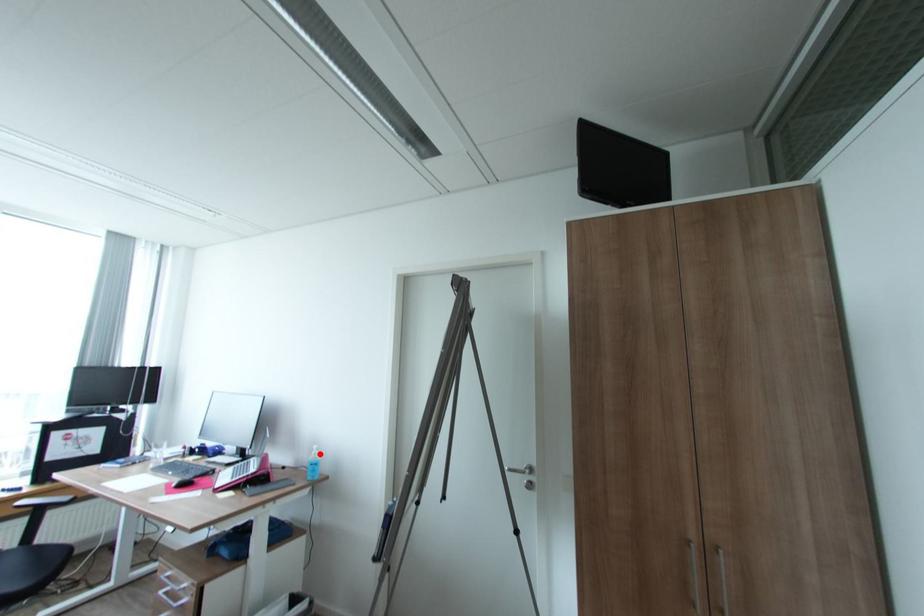
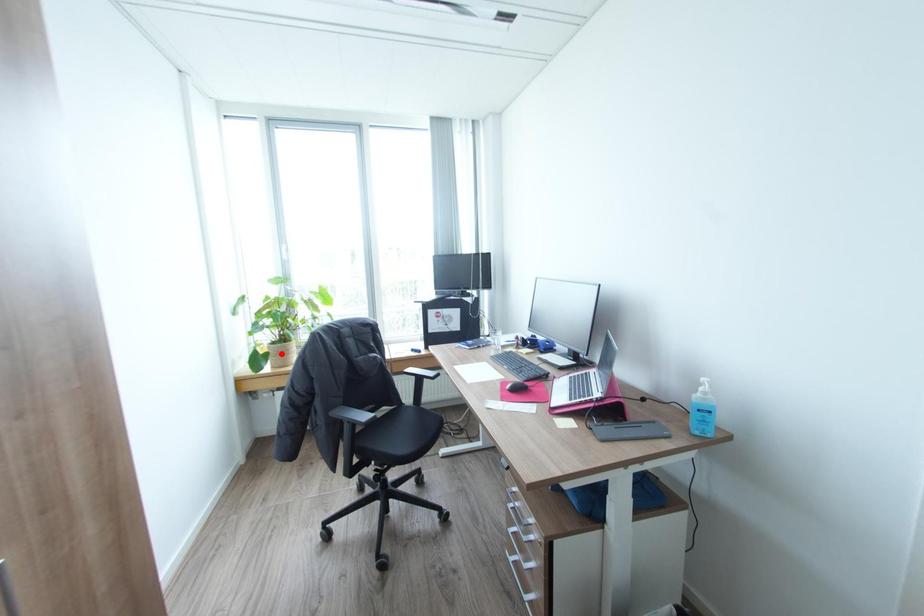
I am providing you with two images of the same scene from different viewpoints. A red point is marked on the first image and another point is marked on the second image. Is the marked point in image1 the same physical position as the marked point in image2?

No